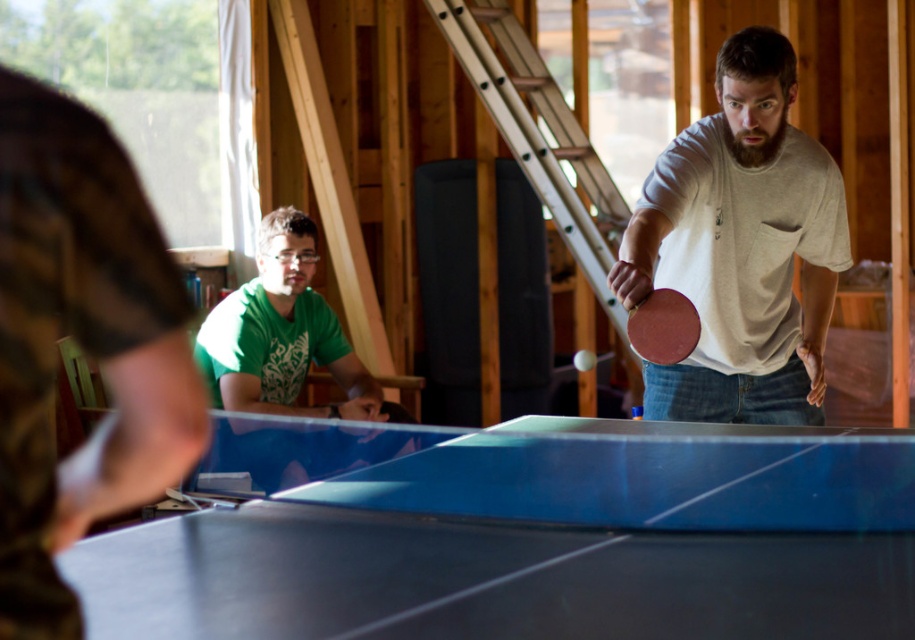
Question: Which of the following is the closest to the observer?

Choices:
 (A) (663, 358)
 (B) (843, 444)

Answer: (A)

Question: Is matte gray t-shirt at right positioned before rubber paddle at center?

Choices:
 (A) no
 (B) yes

Answer: (A)

Question: Which point appears farthest from the camera in this image?

Choices:
 (A) (732, 360)
 (B) (757, 636)

Answer: (A)

Question: Where is blue glossy table tennis table at center located in relation to rubber paddle at center in the image?

Choices:
 (A) above
 (B) below

Answer: (B)

Question: Does blue glossy ping pong table at center appear on the left side of matte gray t-shirt at right?

Choices:
 (A) yes
 (B) no

Answer: (A)

Question: Among these objects, which one is nearest to the camera?

Choices:
 (A) blue glossy table tennis table at center
 (B) blue glossy ping pong table at center
 (C) matte gray t-shirt at right
 (D) rubber paddle at center

Answer: (B)